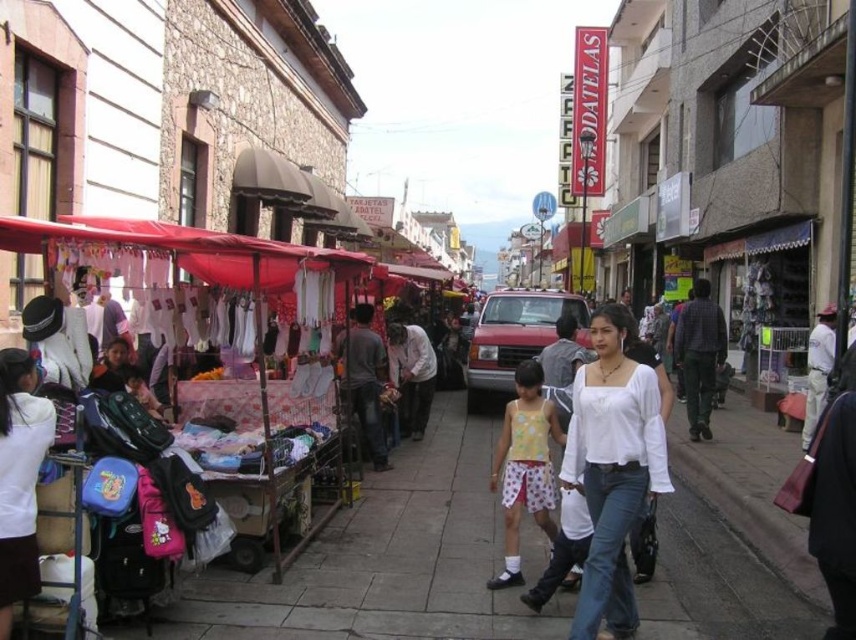
Question: Which object appears farthest from the camera in this image?

Choices:
 (A) smooth concrete sidewalk at center
 (B) white cotton blouse at center

Answer: (A)

Question: Does smooth concrete sidewalk at center come behind white cotton blouse at center?

Choices:
 (A) yes
 (B) no

Answer: (A)

Question: Can you confirm if smooth concrete sidewalk at center is positioned above white cotton blouse at center?

Choices:
 (A) no
 (B) yes

Answer: (A)

Question: From the image, what is the correct spatial relationship of smooth concrete sidewalk at center in relation to white cotton blouse at center?

Choices:
 (A) below
 (B) above

Answer: (A)

Question: Among these points, which one is farthest from the camera?

Choices:
 (A) (441, 454)
 (B) (611, 422)

Answer: (A)